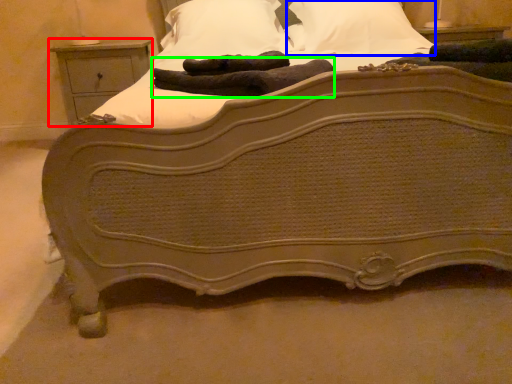
Question: Which is nearer to the nightstand (highlighted by a red box)? pillow (highlighted by a blue box) or material (highlighted by a green box).

Choices:
 (A) pillow
 (B) material

Answer: (A)